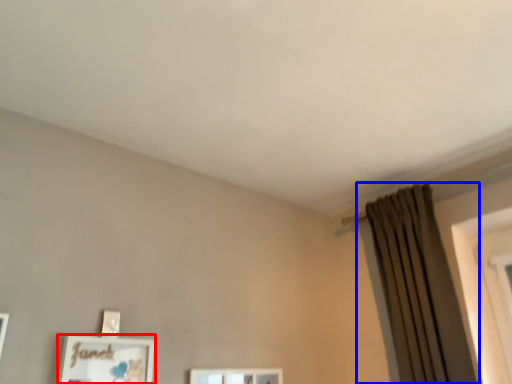
Question: Which of the following is the farthest to the observer, picture frame (highlighted by a red box) or curtain (highlighted by a blue box)?

Choices:
 (A) picture frame
 (B) curtain

Answer: (B)